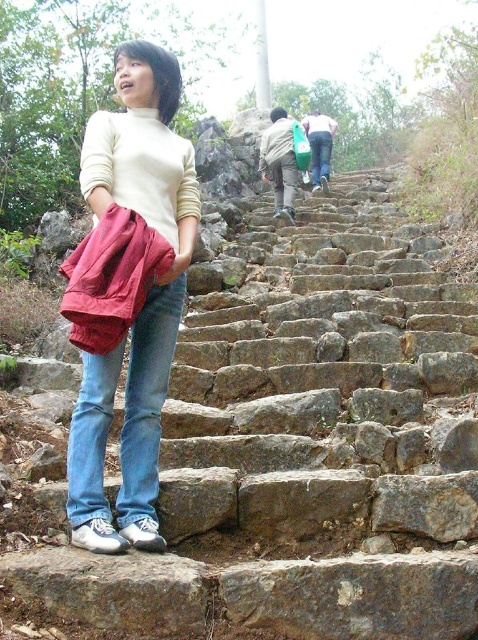
Between rustic stone stairs at center and green fabric bag at upper center, which one appears on the right side from the viewer's perspective?

Positioned to the right is rustic stone stairs at center.

Is rustic stone stairs at center shorter than green fabric bag at upper center?

Incorrect, rustic stone stairs at center's height does not fall short of green fabric bag at upper center's.

The height and width of the screenshot is (640, 478). In order to click on rustic stone stairs at center in this screenshot , I will do `click(280, 448)`.

Locate an element on the screen. This screenshot has width=478, height=640. rustic stone stairs at center is located at coordinates (280, 448).

In the scene shown: Does rustic stone stairs at center have a lesser height compared to matte white sweater at center?

No.

Is point (389, 182) closer to viewer compared to point (156, 474)?

No, (389, 182) is behind (156, 474).

You are a GUI agent. You are given a task and a screenshot of the screen. Output one action in this format:
    pyautogui.click(x=<x>, y=<y>)
    Task: Click on the rustic stone stairs at center
    The image size is (478, 640).
    Given the screenshot: What is the action you would take?
    pyautogui.click(x=280, y=448)

Does matte white sweater at center lie behind green fabric bag at upper center?

That is False.

Does matte white sweater at center appear over green fabric bag at upper center?

No.

Is point (130, 531) more distant than point (274, 209)?

That is False.

This screenshot has width=478, height=640. I want to click on matte white sweater at center, so click(x=104, y=451).